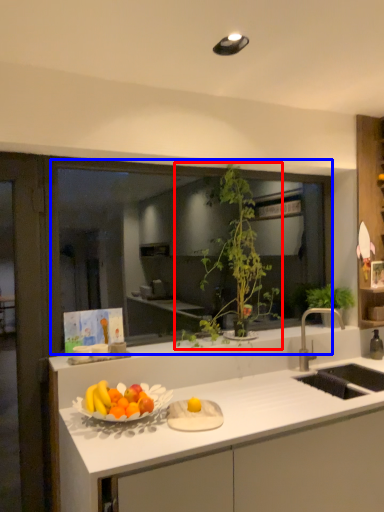
Question: Which object appears closest to the camera in this image, houseplant (highlighted by a red box) or window (highlighted by a blue box)?

Choices:
 (A) houseplant
 (B) window

Answer: (A)